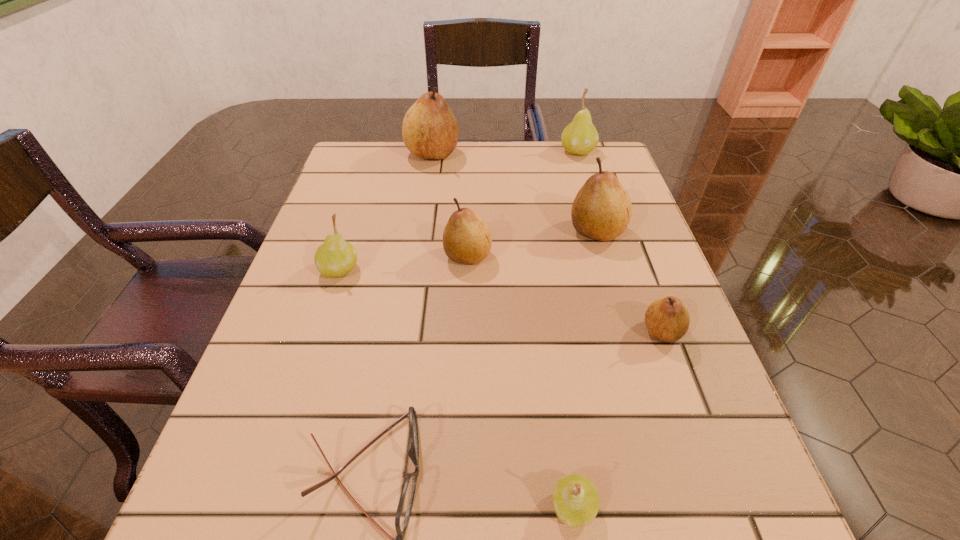
Where is `vacant position in the image that satisfies the following two spatial constraints: 1. on the back side of the nearest pear; 2. on the right side of the smallest brown pear`? The height and width of the screenshot is (540, 960). vacant position in the image that satisfies the following two spatial constraints: 1. on the back side of the nearest pear; 2. on the right side of the smallest brown pear is located at coordinates (548, 331).

I want to click on free spot that satisfies the following two spatial constraints: 1. on the back side of the second nearest green pear; 2. on the left side of the third biggest brown pear, so click(x=345, y=256).

Identify the location of vacant position in the image that satisfies the following two spatial constraints: 1. on the back side of the smallest green pear; 2. on the left side of the farthest green pear. The height and width of the screenshot is (540, 960). (523, 151).